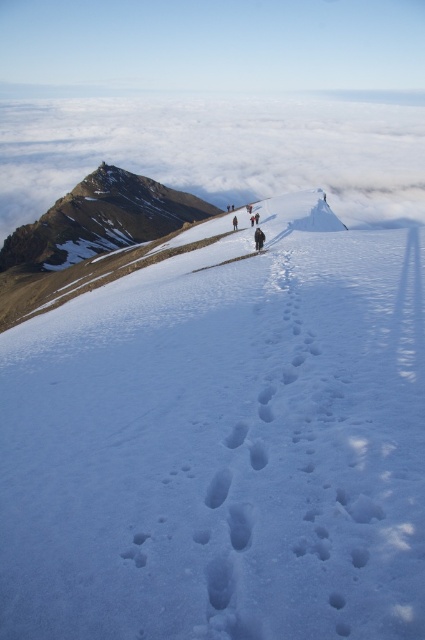
Question: Which point appears farthest from the camera in this image?

Choices:
 (A) (234, 216)
 (B) (192, 324)
 (C) (255, 246)

Answer: (A)

Question: Which of these objects is positioned closest to the white snow at center?

Choices:
 (A) white fluffy cloud at upper center
 (B) snowy rocky peak at upper left

Answer: (B)

Question: Is dark brown fur coat at center above dark brown leather jacket at center?

Choices:
 (A) no
 (B) yes

Answer: (A)

Question: Is white snow at center thinner than snowy rocky peak at upper left?

Choices:
 (A) yes
 (B) no

Answer: (A)

Question: Does snowy rocky peak at upper left appear over dark brown leather jacket at center?

Choices:
 (A) no
 (B) yes

Answer: (B)

Question: Which object appears farthest from the camera in this image?

Choices:
 (A) white snow at center
 (B) snowy rocky peak at upper left

Answer: (B)